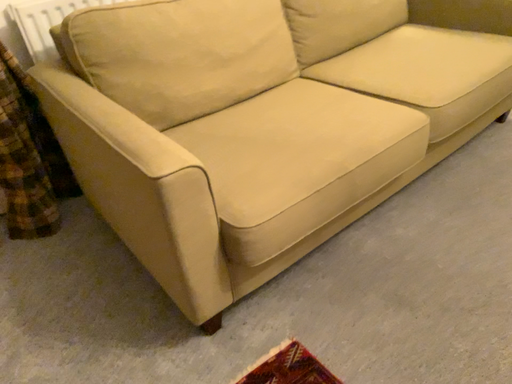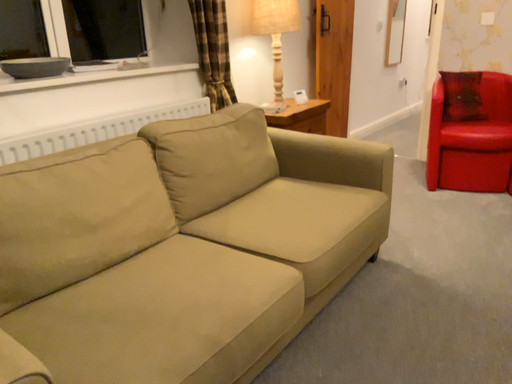
Question: Which way did the camera rotate in the video?

Choices:
 (A) rotated right
 (B) rotated left

Answer: (A)